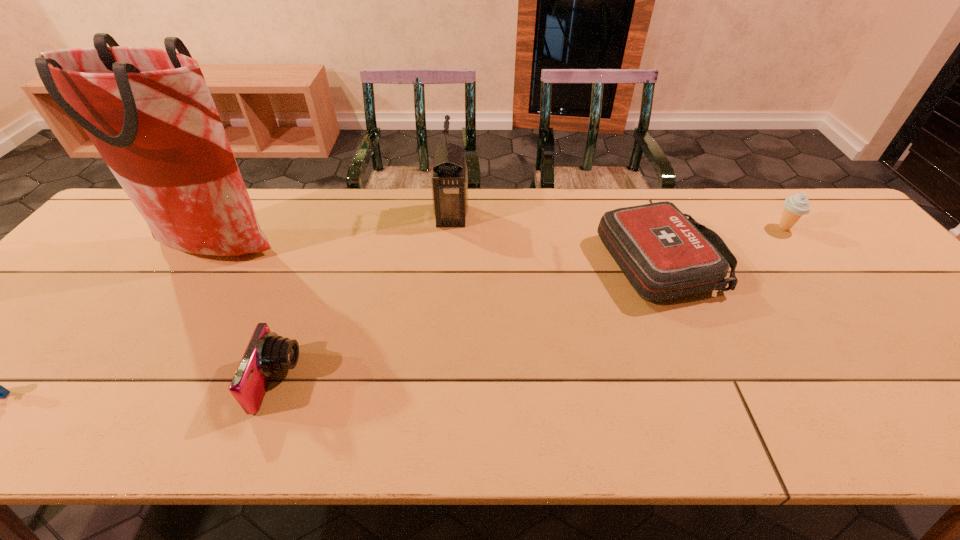
This screenshot has height=540, width=960. I want to click on vacant space at the near edge of the desktop, so click(x=484, y=430).

At what (x,y) coordinates should I click in order to perform the action: click on vacant region at the left edge of the desktop. Please return your answer as a coordinate pair (x, y). Looking at the image, I should click on (73, 308).

The height and width of the screenshot is (540, 960). What are the coordinates of `vacant space at the right edge` in the screenshot? It's located at (914, 307).

The width and height of the screenshot is (960, 540). In order to click on free space between the third object from left to right and the tallest object in this screenshot , I will do `click(248, 315)`.

Locate an element on the screen. The height and width of the screenshot is (540, 960). empty location between the lantern and the fourth object from right to left is located at coordinates (365, 299).

The image size is (960, 540). In order to click on vacant point located between the lantern and the fifth object from left to right in this screenshot , I will do `click(557, 239)`.

You are a GUI agent. You are given a task and a screenshot of the screen. Output one action in this format:
    pyautogui.click(x=<x>, y=<y>)
    Task: Click on the unoccupied area between the second object from left to right and the second tallest object
    
    Given the screenshot: What is the action you would take?
    pyautogui.click(x=335, y=232)

Find the location of a particular element. The height and width of the screenshot is (540, 960). the second closest object to the camera is located at coordinates (0, 392).

Identify which object is located as the third nearest to the Lego. Please provide its 2D coordinates. Your answer should be formatted as a tuple, i.e. [(x, y)], where the tuple contains the x and y coordinates of a point satisfying the conditions above.

[(449, 182)]